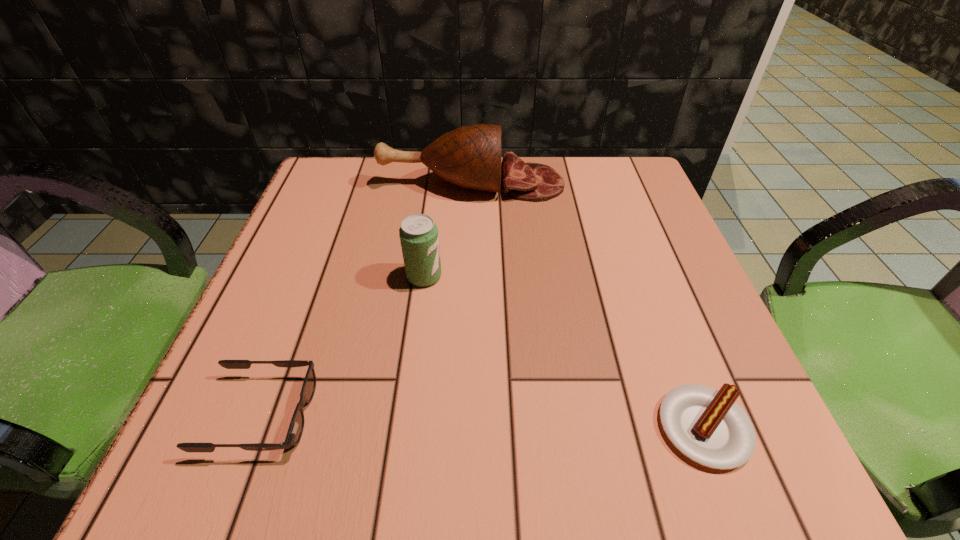
You are a GUI agent. You are given a task and a screenshot of the screen. Output one action in this format:
    pyautogui.click(x=<x>, y=<y>)
    Task: Click on the object present at the far edge
    The width and height of the screenshot is (960, 540).
    Given the screenshot: What is the action you would take?
    pyautogui.click(x=470, y=156)

Locate an element on the screen. Image resolution: width=960 pixels, height=540 pixels. sunglasses that is at the near edge is located at coordinates (295, 430).

Where is `sausage situated at the near edge`? sausage situated at the near edge is located at coordinates (706, 425).

Find the location of a particular element. The image size is (960, 540). ham positioned at the left edge is located at coordinates (470, 156).

This screenshot has width=960, height=540. Identify the location of sunglasses at the left edge. (295, 430).

This screenshot has height=540, width=960. I want to click on object present at the right edge, so click(x=706, y=425).

Find the location of a particular element. object present at the far left corner is located at coordinates (470, 156).

At what (x,y) coordinates should I click in order to perform the action: click on object that is at the near left corner. Please return your answer as a coordinate pair (x, y). The width and height of the screenshot is (960, 540). Looking at the image, I should click on (295, 430).

Locate an element on the screen. object positioned at the near right corner is located at coordinates (706, 425).

In the image, there is a desktop. Where is `free region at the far edge`? This screenshot has height=540, width=960. free region at the far edge is located at coordinates (424, 177).